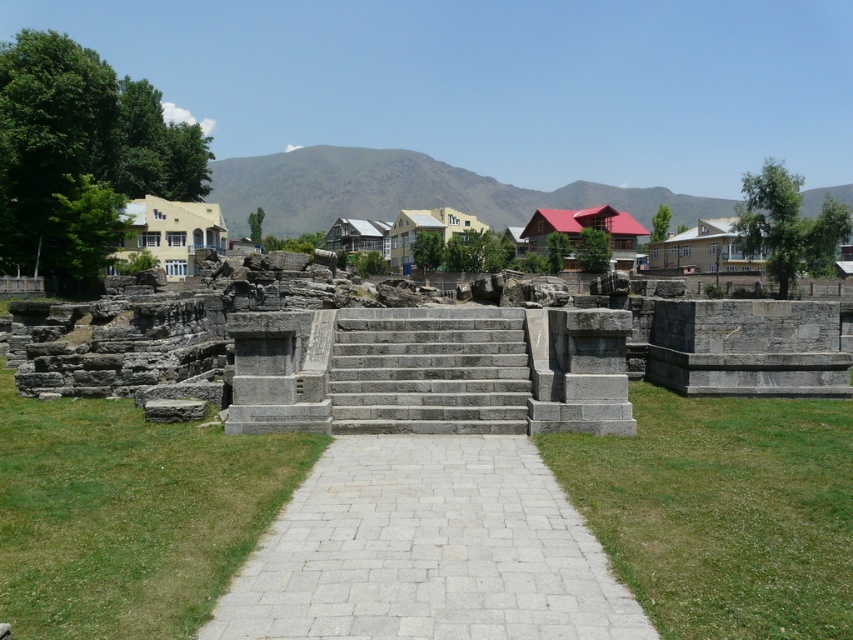
Question: Does gray stone path at center lie behind green grass at center?

Choices:
 (A) yes
 (B) no

Answer: (A)

Question: Can you confirm if gray stone stairs at center is positioned to the left of yellow stucco amphitheater at left?

Choices:
 (A) no
 (B) yes

Answer: (A)

Question: Which point is closer to the camera?

Choices:
 (A) (654, 538)
 (B) (189, 205)

Answer: (A)

Question: Can you confirm if green grass at center is positioned to the left of yellow stucco amphitheater at left?

Choices:
 (A) yes
 (B) no

Answer: (B)

Question: Which point is closer to the camera?

Choices:
 (A) gray stone stairs at center
 (B) gray stone ruins at center
 (C) gray stone path at center
 (D) green grass at center

Answer: (D)

Question: Which point is closer to the camera taking this photo?

Choices:
 (A) (109, 584)
 (B) (787, 529)

Answer: (A)